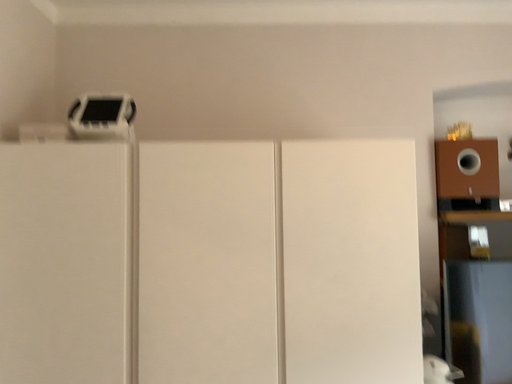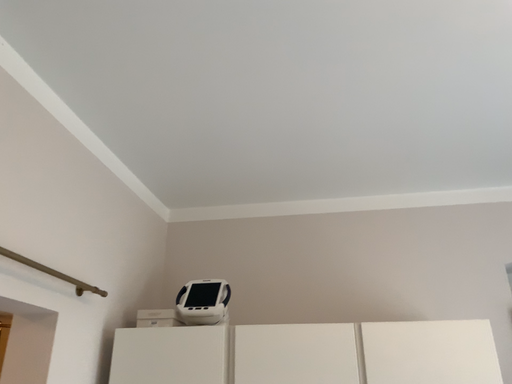
Question: How did the camera likely rotate when shooting the video?

Choices:
 (A) rotated upward
 (B) rotated downward

Answer: (A)